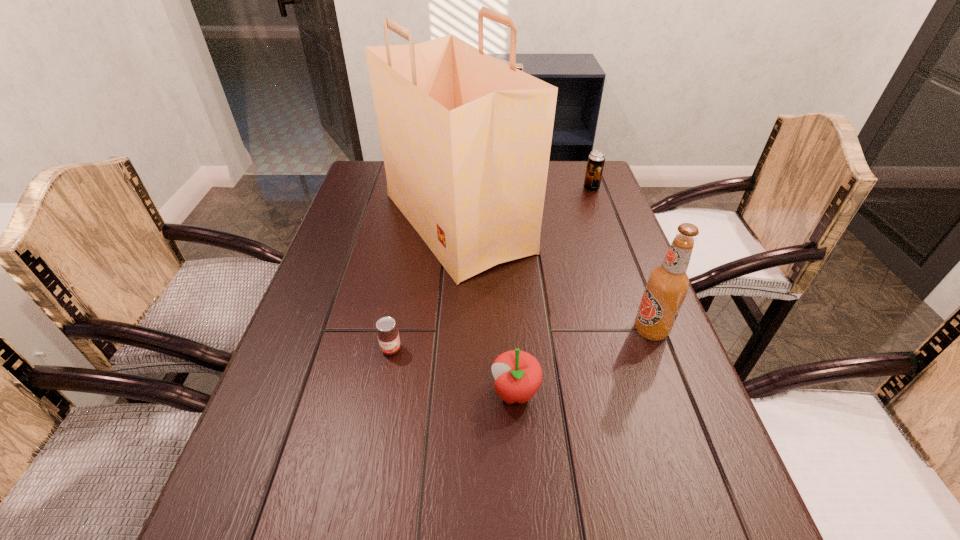
The height and width of the screenshot is (540, 960). What are the coordinates of `object that stands as the closest to the fourth shortest object` in the screenshot? It's located at (466, 139).

You are a GUI agent. You are given a task and a screenshot of the screen. Output one action in this format:
    pyautogui.click(x=<x>, y=<y>)
    Task: Click on the object that is the third closest to the shortest object
    The width and height of the screenshot is (960, 540).
    Given the screenshot: What is the action you would take?
    pyautogui.click(x=668, y=284)

Identify the location of vacant space that satisfies the following two spatial constraints: 1. on the side of the grocery bag with the superhero design; 2. on the label side of the jam. The image size is (960, 540). (448, 349).

The height and width of the screenshot is (540, 960). What are the coordinates of `free region that satisfies the following two spatial constraints: 1. on the side of the tallest object with the superhero design; 2. on the right side of the apple` in the screenshot? It's located at (445, 393).

The height and width of the screenshot is (540, 960). Identify the location of vacant space that satisfies the following two spatial constraints: 1. on the label side of the jam; 2. on the left side of the apple. (383, 393).